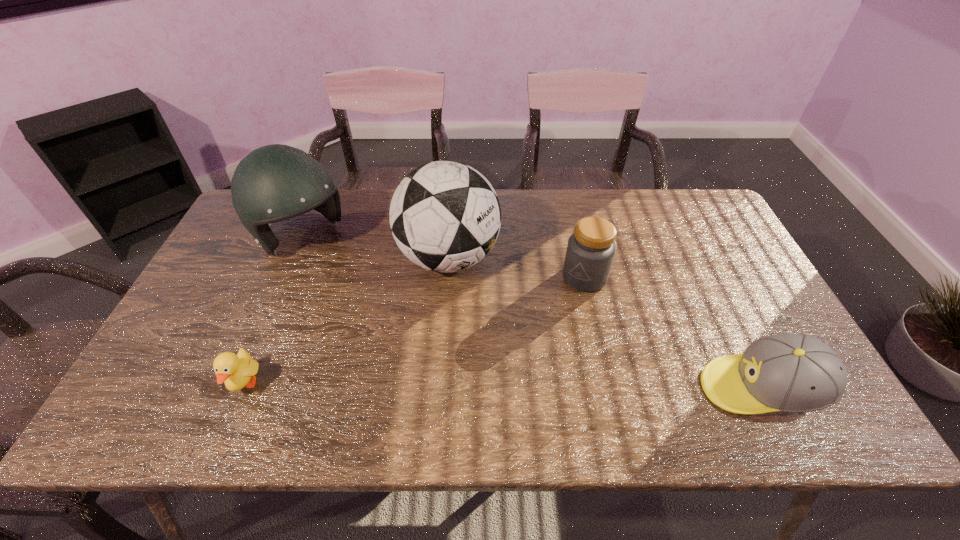
Find the location of `free space located at the face opening of the football helmet`. free space located at the face opening of the football helmet is located at coordinates (342, 278).

This screenshot has height=540, width=960. What are the coordinates of `free space located at the face opening of the football helmet` in the screenshot? It's located at (353, 289).

Image resolution: width=960 pixels, height=540 pixels. In order to click on vacant area located at the face opening of the football helmet in this screenshot , I will do `click(355, 292)`.

The width and height of the screenshot is (960, 540). I want to click on free location located on the surface of the jar near the warning symbol, so click(x=490, y=382).

The width and height of the screenshot is (960, 540). I want to click on vacant region located 0.220m on the surface of the jar near the warning symbol, so point(527,341).

Where is `vacant position located on the surface of the jar near the warning symbol`? Image resolution: width=960 pixels, height=540 pixels. vacant position located on the surface of the jar near the warning symbol is located at coordinates pos(558,307).

The image size is (960, 540). What are the coordinates of `free spot located 0.160m on the surface of the soccer ball where the brand logo is visible` in the screenshot? It's located at (488, 338).

Where is `vacant region located on the surface of the soccer ball where the brand logo is visible`? vacant region located on the surface of the soccer ball where the brand logo is visible is located at coordinates (511, 383).

At what (x,y) coordinates should I click in order to perform the action: click on vacant area situated 0.220m on the surface of the soccer ball where the brand logo is visible. Please return your answer as a coordinate pair (x, y). This screenshot has width=960, height=540. Looking at the image, I should click on (497, 356).

I want to click on football helmet that is at the far edge, so click(x=276, y=182).